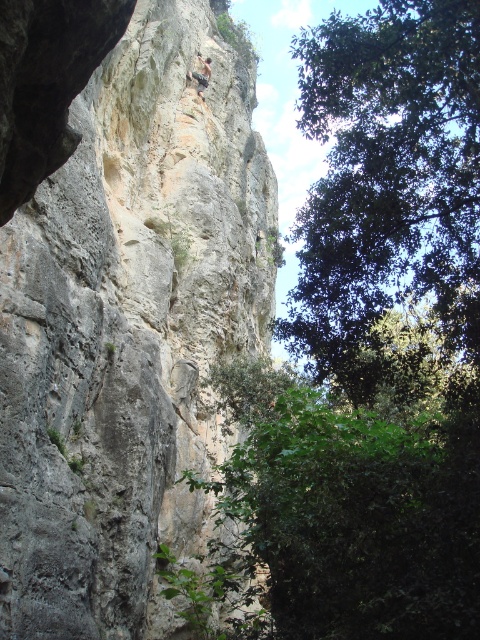
Consider the image. Is gray rough rock at center to the right of green leafy tree at upper right from the viewer's perspective?

No, gray rough rock at center is not to the right of green leafy tree at upper right.

Does gray rough rock at center have a larger size compared to green leafy tree at upper right?

Actually, gray rough rock at center might be smaller than green leafy tree at upper right.

What are the coordinates of `gray rough rock at center` in the screenshot? It's located at (129, 330).

At what (x,y) coordinates should I click in order to perform the action: click on gray rough rock at center. Please return your answer as a coordinate pair (x, y). The height and width of the screenshot is (640, 480). Looking at the image, I should click on (129, 330).

Which is in front, point (153, 381) or point (202, 68)?

Point (153, 381)

Image resolution: width=480 pixels, height=640 pixels. What are the coordinates of `gray rough rock at center` in the screenshot? It's located at (129, 330).

Is green leafy tree at upper right smaller than rugged stone climber at upper center?

No.

Who is higher up, green leafy tree at upper right or rugged stone climber at upper center?

green leafy tree at upper right is above.

The height and width of the screenshot is (640, 480). I want to click on green leafy tree at upper right, so click(389, 195).